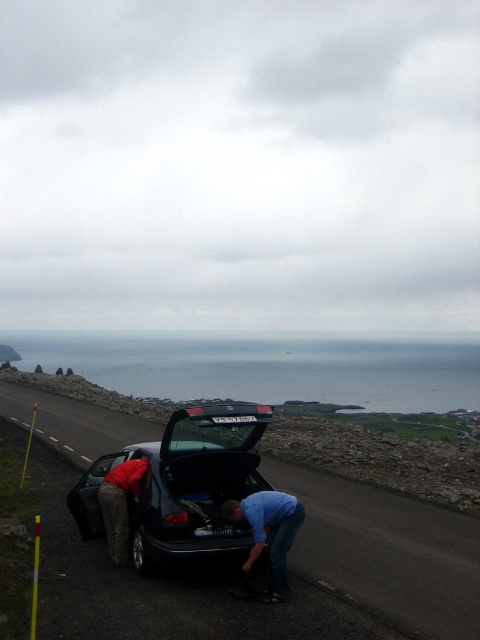
You are standing at point (279, 547) and want to walk to point (94, 525). Based on the scene description, will you have to walk towards the car or away from it?

Point (94, 525) is behind point (279, 547), so you will have to walk towards the car to reach it.

From the picture: You are a photographer planning to capture a wide shot of the coastal road scene. The black matte car at center and the blue denim jeans at lower center are both in your frame. Considering their sizes in the image, which object would appear smaller in your photograph?

The black matte car at center appears smaller than the blue denim jeans at lower center in the image.